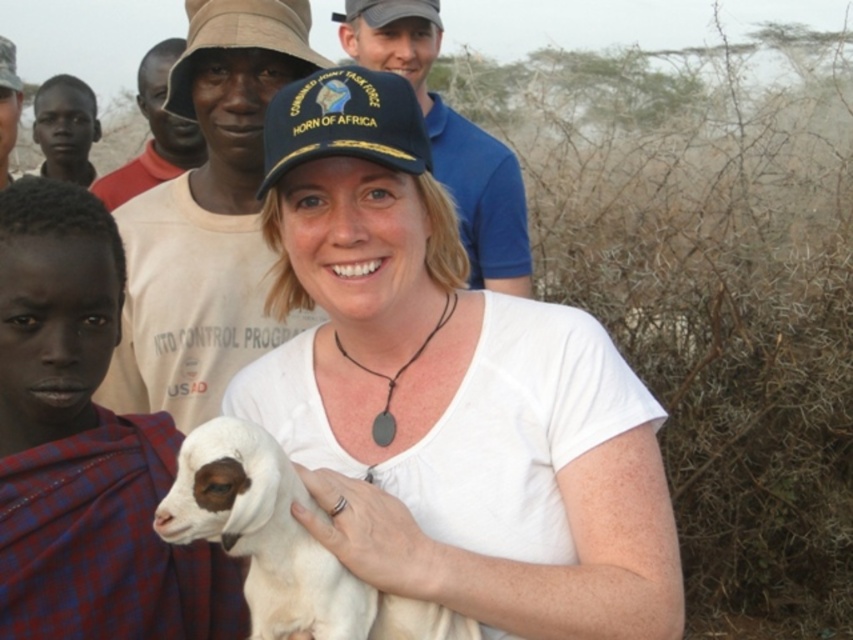
You are a photographer trying to capture a photo of the white matte shirt at center and the white woolen lamb at center. Based on their positions, which one should you focus on first if you want to start from the left side of the scene?

The white woolen lamb at center should be focused on first because it is positioned to the left of the white matte shirt at center.

Based on the photo, you are a photographer standing in the scene. You want to take a photo of the blue fabric cap at upper center without the white woolen lamb at center blocking it. How should you adjust your position?

Move to the side so that the white woolen lamb at center is no longer in front of the blue fabric cap at upper center. Since the lamb is in front of the cap, shifting your position sideways can reposition the lamb out of the frame or behind the cap.

You are a photographer standing at the camera position. You want to take a closeup photo of the white woolen lamb at center. Is the lamb within your camera range if your camera can focus on objects within 1.5 meters?

The white woolen lamb at center is 1.45 meters away from camera, so yes, it is within the camera range since 1.45 meters is less than 1.5 meters.